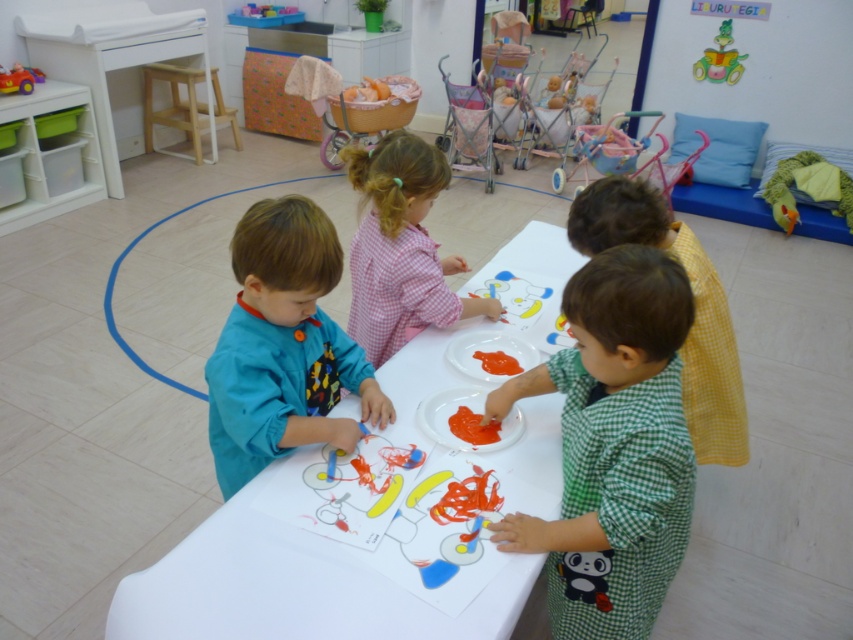
Who is more forward, (302, 378) or (376, 266)?

Point (302, 378) is in front.

Which of these two, matte blue shirt at left or pink checkered shirt at center, stands taller?

Standing taller between the two is matte blue shirt at left.

What do you see at coordinates (283, 346) in the screenshot? I see `matte blue shirt at left` at bounding box center [283, 346].

Locate an element on the screen. This screenshot has width=853, height=640. matte blue shirt at left is located at coordinates coord(283,346).

Which of these two, pink checkered shirt at center or rubberized plastic toy car at upper left, stands taller?

With more height is pink checkered shirt at center.

Which of these two, pink checkered shirt at center or rubberized plastic toy car at upper left, stands shorter?

Standing shorter between the two is rubberized plastic toy car at upper left.

Between point (419, 157) and point (16, 61), which one is positioned in front?

Point (419, 157)

This screenshot has width=853, height=640. Identify the location of pink checkered shirt at center. (399, 248).

In the scene shown: Who is more distant from viewer, (611, 364) or (18, 88)?

Point (18, 88)

Who is more distant from viewer, (577, 330) or (28, 83)?

Positioned behind is point (28, 83).

This screenshot has width=853, height=640. I want to click on green checkered shirt at center, so click(613, 445).